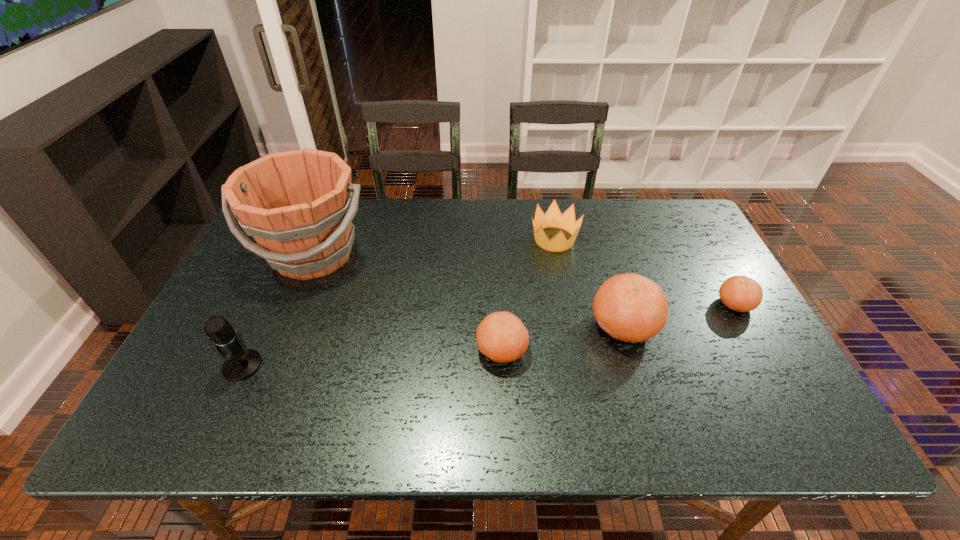
Find the location of `the leftmost clementine`. the leftmost clementine is located at coordinates (501, 336).

Image resolution: width=960 pixels, height=540 pixels. What are the coordinates of `the third object from left to right` in the screenshot? It's located at (501, 336).

You are a GUI agent. You are given a task and a screenshot of the screen. Output one action in this format:
    pyautogui.click(x=<x>, y=<y>)
    Task: Click on the fourth shortest object
    
    Given the screenshot: What is the action you would take?
    pyautogui.click(x=629, y=307)

Where is `the second clementine from right to left`? The height and width of the screenshot is (540, 960). the second clementine from right to left is located at coordinates (629, 307).

Where is `the rightmost clementine`? Image resolution: width=960 pixels, height=540 pixels. the rightmost clementine is located at coordinates (739, 293).

Locate an element on the screen. the rightmost object is located at coordinates (739, 293).

The image size is (960, 540). I want to click on bucket, so click(298, 205).

At what (x,y) coordinates should I click in order to perform the action: click on crown. Please return your answer as a coordinate pair (x, y). This screenshot has width=960, height=540. Looking at the image, I should click on (553, 218).

The height and width of the screenshot is (540, 960). Identify the location of microphone. (239, 364).

Find the location of a particular element. The width and height of the screenshot is (960, 540). vacant area located on the right of the leftmost clementine is located at coordinates (663, 350).